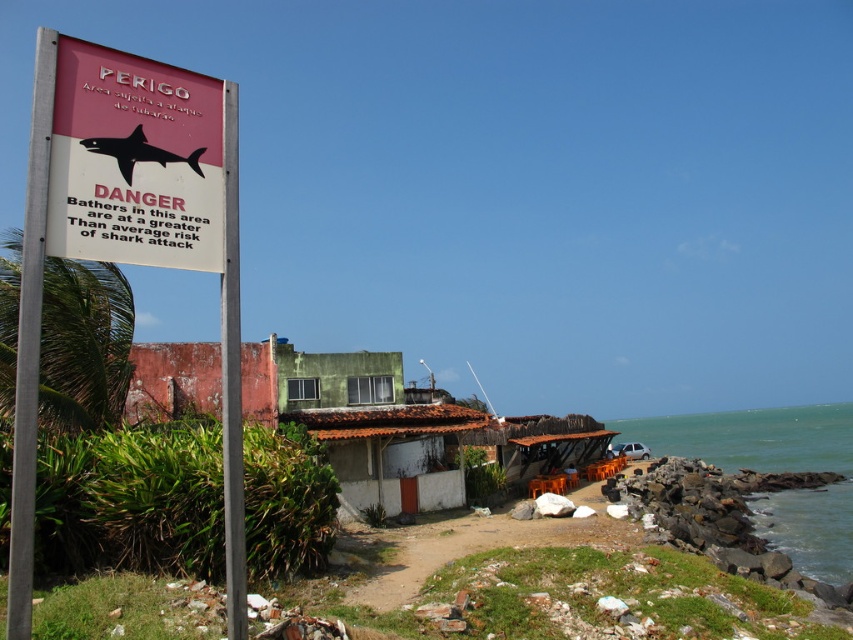
You are a lifeguard on duty at the beach and need to ensure safety. From your vantage point, you see the green water at lower right and the silver metallic pole at left. Which object is closer to the shoreline?

The green water at lower right is positioned under the silver metallic pole at left, indicating that the green water at lower right is closer to the shoreline since it is located beneath the pole.

You are a tourist standing at the beach and see the metallic signboard at left and the green water at lower right. Which object is closer to you?

The metallic signboard at left is closer to you because it is positioned over the green water at lower right, indicating it is in front of it.